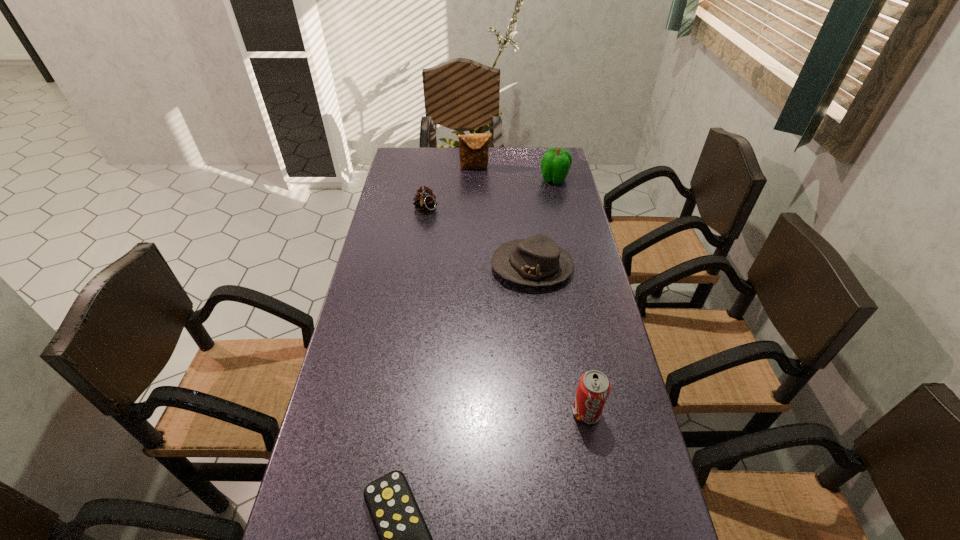
Where is `clutch bag`? This screenshot has height=540, width=960. clutch bag is located at coordinates (473, 148).

Locate an element on the screen. This screenshot has width=960, height=540. bell pepper is located at coordinates (555, 164).

The height and width of the screenshot is (540, 960). I want to click on the second nearest object, so click(x=594, y=387).

The image size is (960, 540). In order to click on the third farthest object in this screenshot , I will do [x=425, y=201].

You are a GUI agent. You are given a task and a screenshot of the screen. Output one action in this format:
    pyautogui.click(x=<x>, y=<y>)
    Task: Click on the hat
    This screenshot has width=960, height=540.
    Given the screenshot: What is the action you would take?
    pyautogui.click(x=537, y=261)

Locate an element on the screen. vacant space located 0.240m on the open side of the clutch bag is located at coordinates (475, 205).

The image size is (960, 540). I want to click on vacant point located 0.240m on the front of the bell pepper, so click(x=564, y=225).

This screenshot has height=540, width=960. Find the location of `blank space located on the front of the soda can`. blank space located on the front of the soda can is located at coordinates (596, 465).

At what (x,y) coordinates should I click in order to perform the action: click on free space located with a leaf charm attached to the pinecone. Please return your answer as a coordinate pair (x, y). Looking at the image, I should click on (414, 285).

This screenshot has width=960, height=540. What are the coordinates of `vacant region located 0.280m on the decorative side of the hat` in the screenshot? It's located at (403, 267).